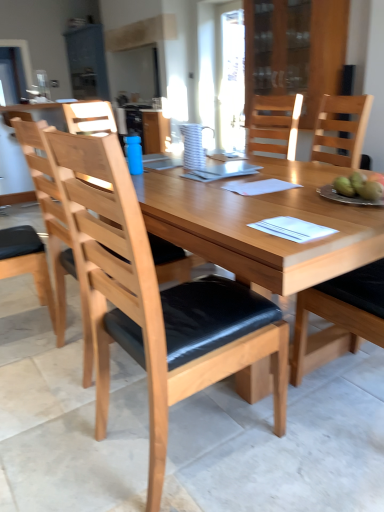
At what (x,y) coordinates should I click in order to perform the action: click on vacant area that lies in front of light brown wood chair at center, positioned as the 1th chair in left-to-right order. Please return your answer as a coordinate pair (x, y). The width and height of the screenshot is (384, 512). Looking at the image, I should click on (73, 410).